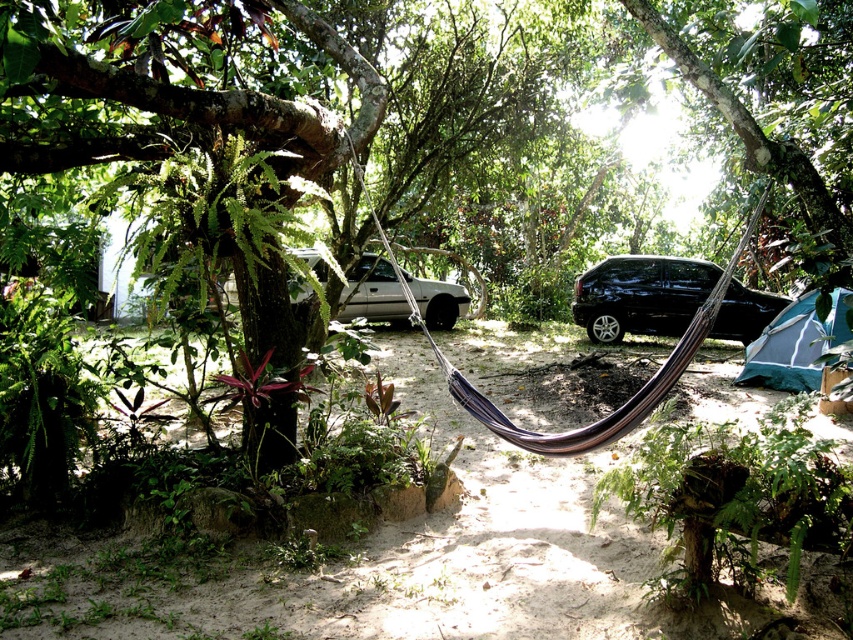
You are planning to hang a swing between the green rough bark tree at upper left and the green leafy tree at upper center. Which tree should you attach the swing to first if you want the swing to be closer to the hammock in the foreground?

You should attach the swing to the green rough bark tree at upper left first because it is in front of the green leafy tree at upper center, making it closer to the hammock in the foreground.

You are planning to take a photo of the green rough bark tree at upper left and the black glossy car at center. Which object should you focus on first if you want to capture both in the same frame without moving the camera?

The green rough bark tree at upper left is located above the black glossy car at center, so you should focus on the black glossy car at center first to ensure both are in the frame.